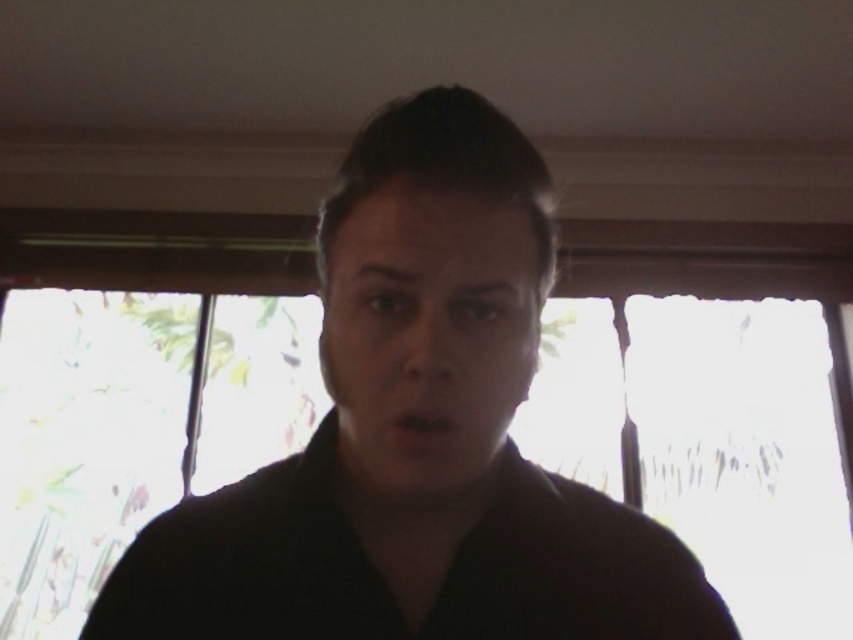
You are standing in the room shown in the image and want to move from one point to another. If you start at point (234, 532) and walk towards point (677, 579), will you be moving towards the window or away from it?

Point (677, 579) is behind point (234, 532), so moving towards it would mean moving away from the window.

You are standing in the room and want to reach both points. Which point, point (389, 134) or point (453, 477), is closer to you?

Point (389, 134) is closer to the viewer than point (453, 477).

You are a photographer adjusting your camera settings to capture the scene. The black matte robe at center and the matte black face at center are both in focus. If you want to ensure that both remain in focus while taking a photo, what minimum distance should the depth of field cover?

The depth of field must cover at least 3.38 inches to keep both the black matte robe at center and the matte black face at center in focus since they are 3.38 inches apart.